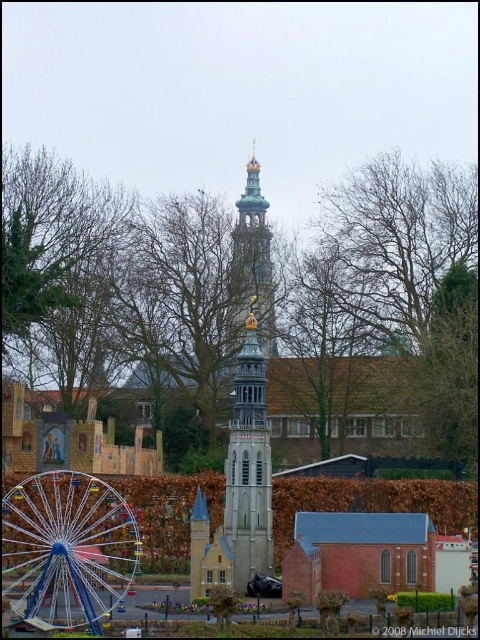
Question: Estimate the real-world distances between objects in this image. Which object is farther from the stone tower at center?

Choices:
 (A) blue metallic ferris wheel at lower left
 (B) bare branches at upper center
 (C) gold/gilded metal tower at center

Answer: (C)

Question: Can you confirm if bare branches at upper center is smaller than stone tower at center?

Choices:
 (A) yes
 (B) no

Answer: (B)

Question: Which point is closer to the camera?

Choices:
 (A) blue metallic ferris wheel at lower left
 (B) gold/gilded metal tower at center

Answer: (A)

Question: Among these objects, which one is nearest to the camera?

Choices:
 (A) gold/gilded metal tower at center
 (B) stone tower at center
 (C) bare branches at upper center
 (D) blue metallic ferris wheel at lower left

Answer: (D)

Question: Can you confirm if bare branches at upper center is smaller than gold/gilded metal tower at center?

Choices:
 (A) no
 (B) yes

Answer: (A)

Question: Can you confirm if bare branches at upper center is positioned to the left of stone tower at center?

Choices:
 (A) yes
 (B) no

Answer: (B)